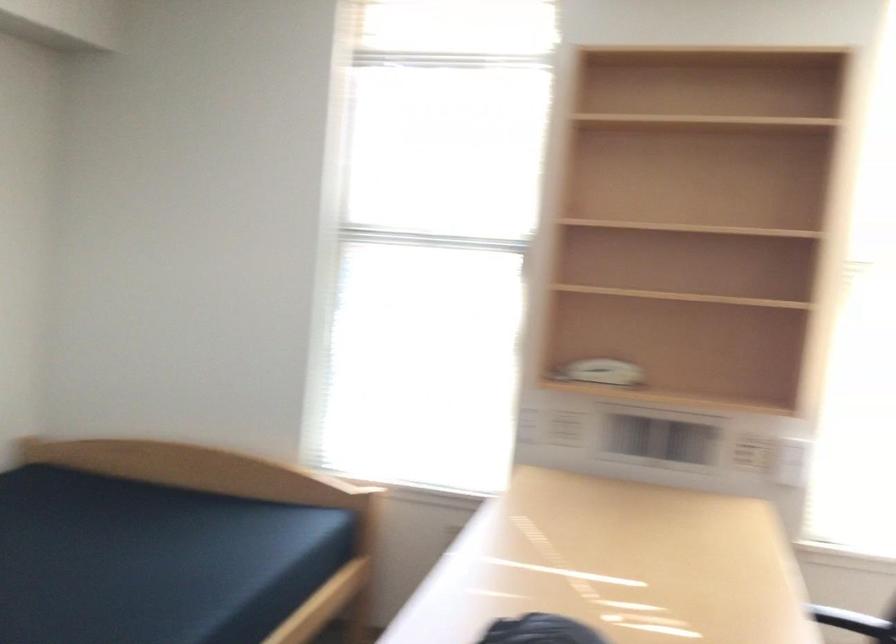
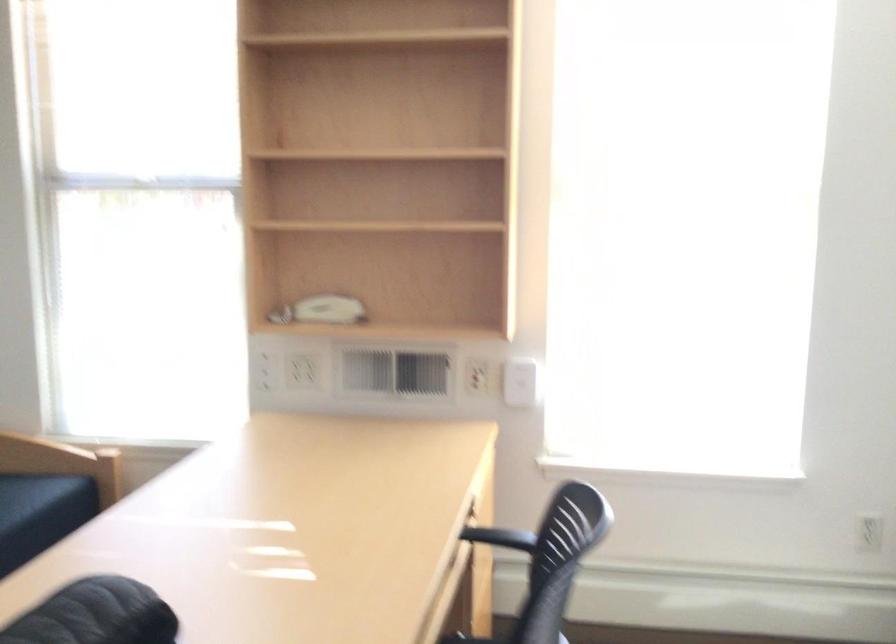
Where in the second image is the point corresponding to the point at 565,429 from the first image?

(303, 371)